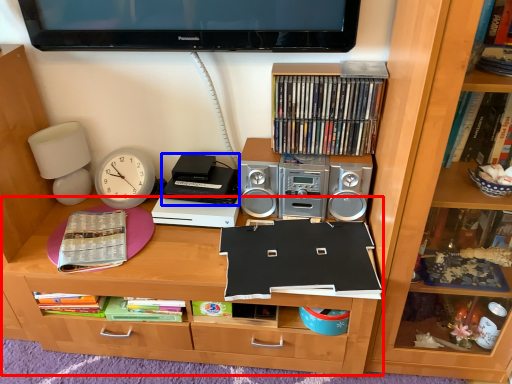
Question: Which object is closer to the camera taking this photo, desk (highlighted by a red box) or cassette (highlighted by a blue box)?

Choices:
 (A) desk
 (B) cassette

Answer: (A)